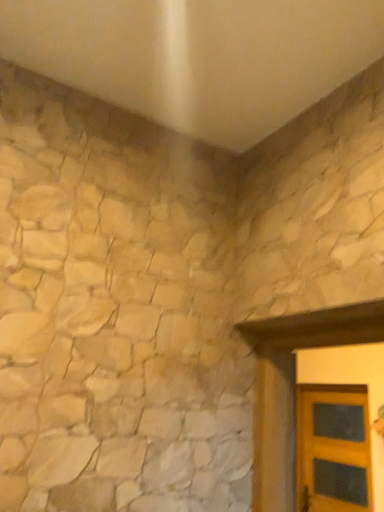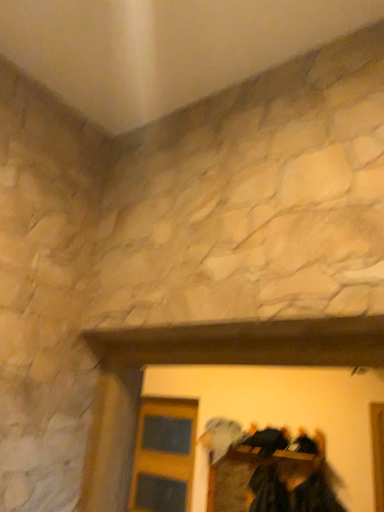
Question: Which way did the camera rotate in the video?

Choices:
 (A) rotated right
 (B) rotated left

Answer: (A)